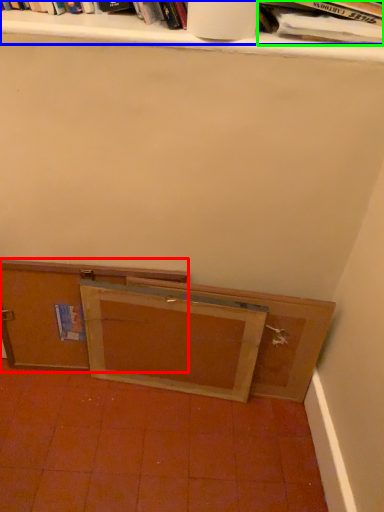
Question: Which is farther away from cabinetry (highlighted by a red box)? book (highlighted by a blue box) or book (highlighted by a green box)?

Choices:
 (A) book
 (B) book

Answer: (B)